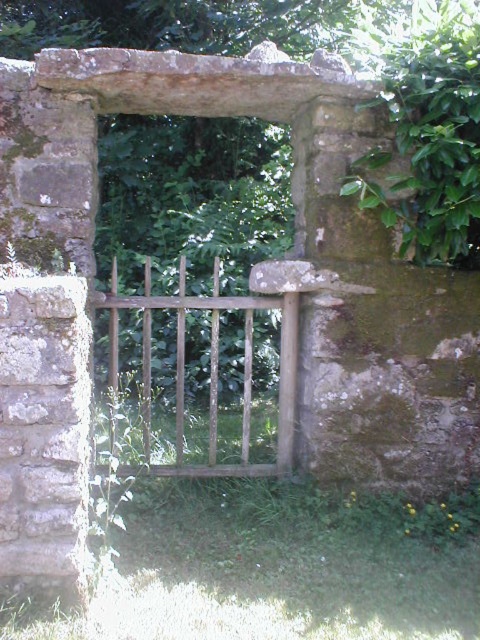
You are a gardener who wants to mow the green grass at center. The wooden gate at center is in the way. Can you mow the grass without moving the gate?

The green grass at center is shorter than the wooden gate at center, so the mower can pass under the wooden gate at center without hitting it. Therefore, you can mow the green grass at center without moving the gate.

You are standing in front of the old stone archway with the wooden gate. There are two points marked on the gate. One is at coordinate point (x=357, y=618) and the other at point (x=142, y=340). Which point is closer to you?

Point (x=357, y=618) is closer to the viewer than point (x=142, y=340).

You are standing in front of the old stone archway and want to step onto the green grass at center. Is the wooden gate at center blocking your path?

The green grass at center is in front of the wooden gate at center, so the wooden gate at center is not blocking your path. You can step onto the green grass at center freely.